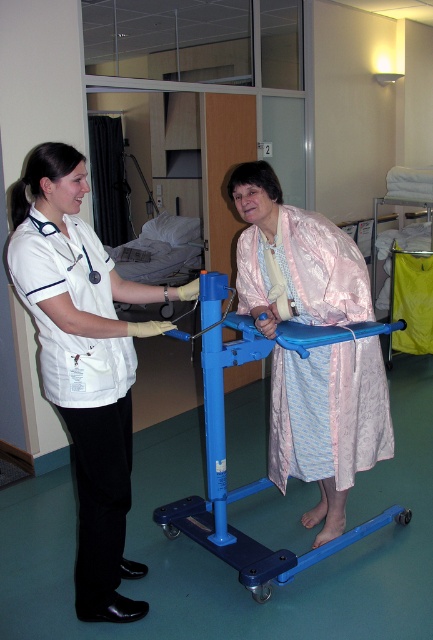
You are a healthcare worker in the hospital room. You need to move a medical cart that is 12 inches wide through the space between the pink satin robe at center and the blue plastic walker at center. Can the cart fit through the space?

The distance between the pink satin robe at center and the blue plastic walker at center is 9.25 inches. Since the medical cart is 12 inches wide, it cannot fit through the space as it is narrower than the cart.

You are a healthcare worker in the hospital room. You need to locate the white smooth uniform at left and the pink satin robe at center. Based on the scene, which object is positioned lower in the image?

The white smooth uniform at left is located below the pink satin robe at center, so the white smooth uniform at left is positioned lower in the image.